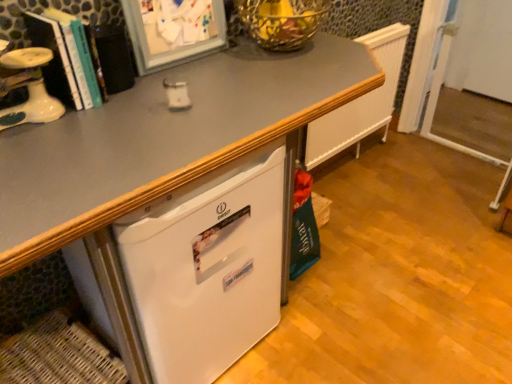
What are the coordinates of `vacant area to the right of white textured radiator at upper right` in the screenshot? It's located at (416, 176).